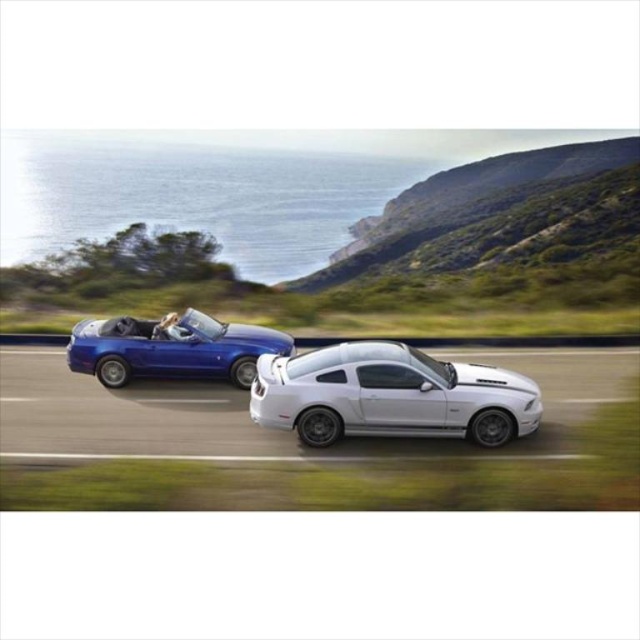
Question: Among these points, which one is farthest from the camera?

Choices:
 (A) (289, 339)
 (B) (426, 362)

Answer: (A)

Question: Which object is farther from the camera taking this photo?

Choices:
 (A) white glossy car at center
 (B) shiny metallic blue convertible at left

Answer: (B)

Question: Does white glossy car at center appear on the left side of shiny metallic blue convertible at left?

Choices:
 (A) yes
 (B) no

Answer: (B)

Question: Considering the relative positions of white glossy car at center and shiny metallic blue convertible at left in the image provided, where is white glossy car at center located with respect to shiny metallic blue convertible at left?

Choices:
 (A) above
 (B) below

Answer: (B)

Question: Considering the relative positions of white glossy car at center and shiny metallic blue convertible at left in the image provided, where is white glossy car at center located with respect to shiny metallic blue convertible at left?

Choices:
 (A) left
 (B) right

Answer: (B)

Question: Which point is farther to the camera?

Choices:
 (A) shiny metallic blue convertible at left
 (B) white glossy car at center

Answer: (A)